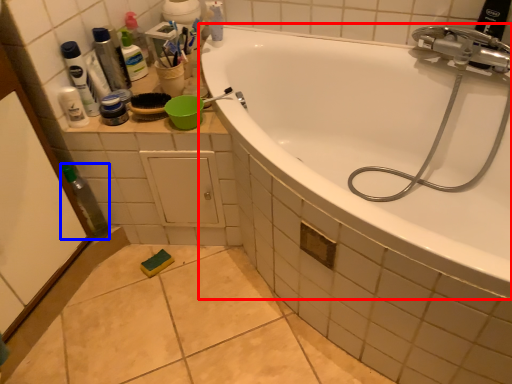
Question: Among these objects, which one is farthest to the camera, bathtub (highlighted by a red box) or bottle (highlighted by a blue box)?

Choices:
 (A) bathtub
 (B) bottle

Answer: (B)